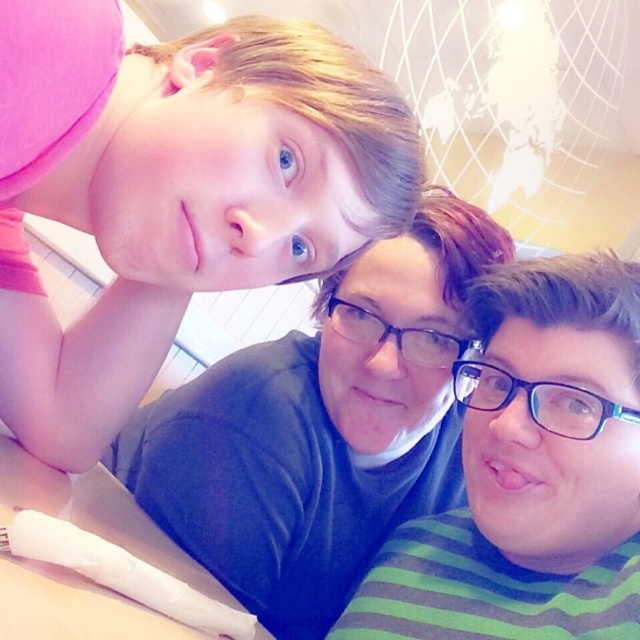
Which is in front, point (483, 369) or point (586, 420)?

Point (586, 420) is in front.

Between green striped shirt at center and blue plastic glasses at center, which one has more height?

Standing taller between the two is green striped shirt at center.

Which is in front, point (488, 376) or point (516, 380)?

Positioned in front is point (516, 380).

Identify the location of green striped shirt at center. (531, 472).

Does green striped shirt at center have a larger size compared to transparent plastic glasses at center?

Yes.

Is green striped shirt at center closer to the viewer compared to transparent plastic glasses at center?

Yes, green striped shirt at center is closer to the viewer.

Is point (550, 323) closer to camera compared to point (352, 320)?

Yes, point (550, 323) is closer to viewer.

The height and width of the screenshot is (640, 640). Identify the location of green striped shirt at center. (531, 472).

Which is below, pink matte shirt at upper left or blue plastic glasses at center?

Positioned lower is blue plastic glasses at center.

Between point (124, 342) and point (589, 432), which one is positioned behind?

The point (124, 342) is behind.

Image resolution: width=640 pixels, height=640 pixels. I want to click on pink matte shirt at upper left, so click(198, 209).